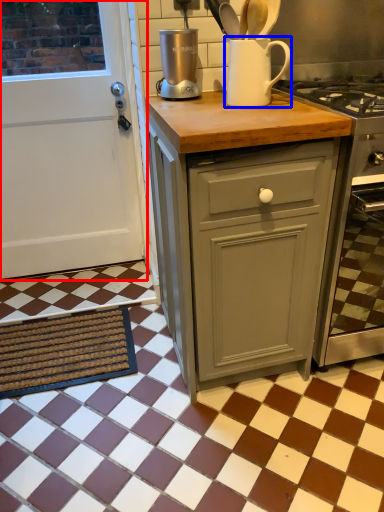
Question: Among these objects, which one is nearest to the camera, door (highlighted by a red box) or jug (highlighted by a blue box)?

Choices:
 (A) door
 (B) jug

Answer: (B)